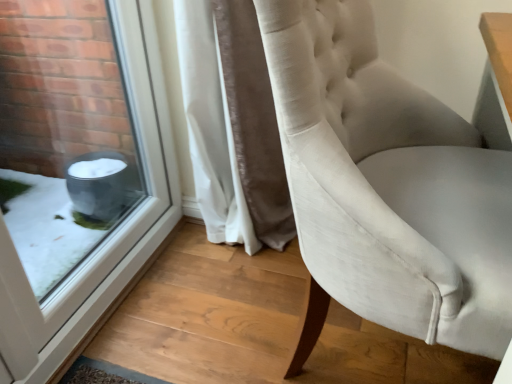
Question: Is transparent glass window at lower left in front of or behind satin white chair at center in the image?

Choices:
 (A) behind
 (B) front

Answer: (A)

Question: Looking at their shapes, would you say transparent glass window at lower left is wider or thinner than satin white chair at center?

Choices:
 (A) wide
 (B) thin

Answer: (B)

Question: Based on their relative distances, which object is nearer to the white velvet curtain at center?

Choices:
 (A) transparent glass window at lower left
 (B) satin white chair at center

Answer: (A)

Question: Which object is positioned closest to the transparent glass window at lower left?

Choices:
 (A) satin white chair at center
 (B) white velvet curtain at center

Answer: (B)